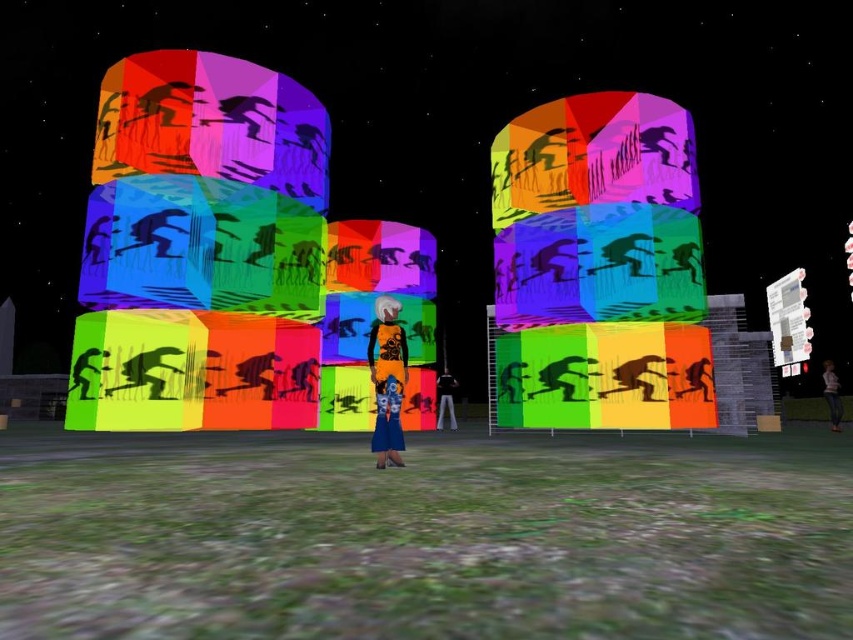
From the picture: You are standing in the grassy area looking at the two points in the image. Which point is closer to you, the point at coordinates point (387, 420) or point (828, 380)?

Point (387, 420) is in front of point (828, 380), so it is closer to you.

Looking at the image, there is a point marked at coordinates (387, 380). What object is located at this point?

The point at coordinates (387, 380) corresponds to the orange fabric dress at center.